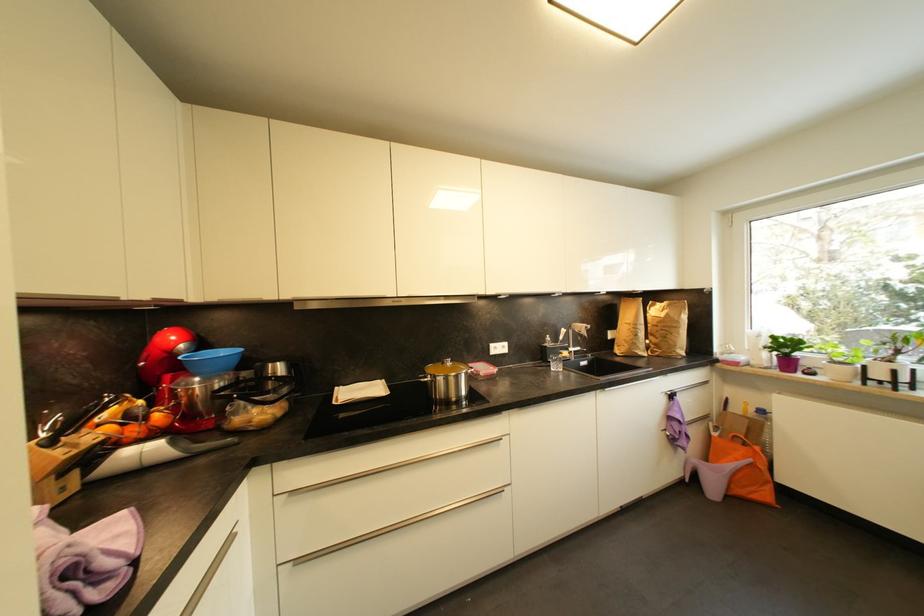
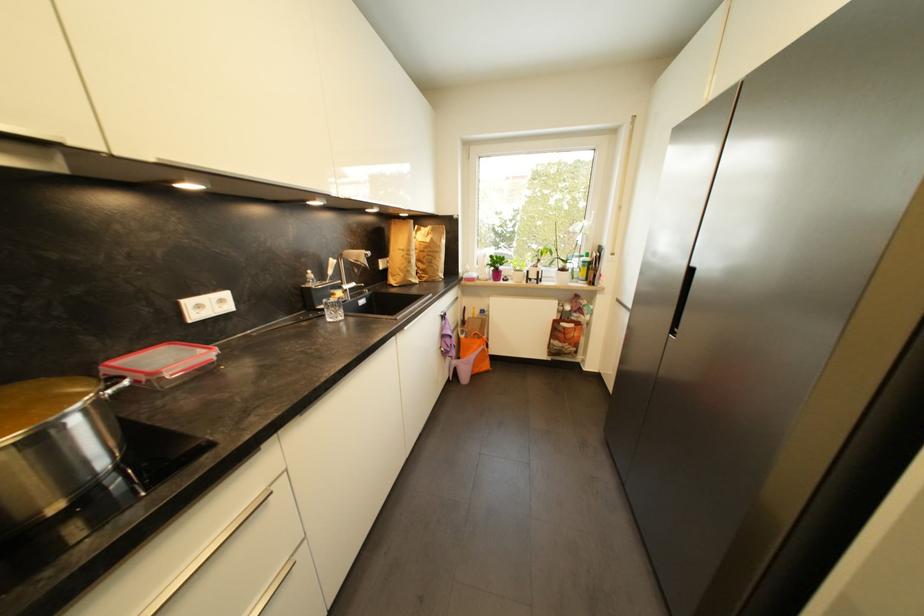
Where in the second image is the point corresponding to the point at 640,337 from the first image?

(415, 264)